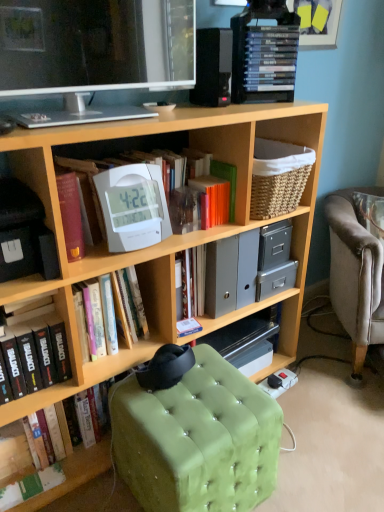
Identify the location of green tufted ottoman at lower center. (195, 433).

What is the approximate height of white plastic clock at center, the fourth book in the bottom-to-top sequence?

white plastic clock at center, the fourth book in the bottom-to-top sequence, is 9.89 inches tall.

Measure the distance between light gray fabric armchair at right and camera.

The distance of light gray fabric armchair at right from camera is 5.10 feet.

This screenshot has height=512, width=384. Describe the element at coordinates (170, 236) in the screenshot. I see `wooden bookcase at center` at that location.

Describe the element at coordinates (31, 486) in the screenshot. This screenshot has width=384, height=512. I see `green paper book at lower left, which appears as the 1th book when ordered from the bottom` at that location.

The image size is (384, 512). I want to click on white plastic clock at upper center, the third book in the top-to-bottom sequence, so click(128, 305).

The image size is (384, 512). Describe the element at coordinates (270, 58) in the screenshot. I see `black matte book at upper right, which is the 1th book from top to bottom` at that location.

Locate an element on the screen. This screenshot has height=512, width=384. green tufted ottoman at lower center is located at coordinates (195, 433).

In the scene shown: Is black cardboard box at left positioned with its back to black matte book at lower left, which is the fourth book in top-to-bottom order?

No.

Based on the photo, from their relative heights in the image, would you say black cardboard box at left is taller or shorter than black matte book at lower left, which is the fourth book in top-to-bottom order?

Considering their sizes, black cardboard box at left has less height than black matte book at lower left, which is the fourth book in top-to-bottom order.

Is black cardboard box at left in contact with black matte book at lower left, which is the fourth book in top-to-bottom order?

black cardboard box at left is not next to black matte book at lower left, which is the fourth book in top-to-bottom order, and they're not touching.

Does point (19, 155) come farther from viewer compared to point (12, 341)?

No, it is in front of (12, 341).

Would you say light gray fabric armchair at right contains orange matte paper at center?

Definitely not — orange matte paper at center is not inside light gray fabric armchair at right.

From the image's perspective, is light gray fabric armchair at right located above or below orange matte paper at center?

light gray fabric armchair at right is below orange matte paper at center.

Considering the relative sizes of light gray fabric armchair at right and orange matte paper at center in the image provided, is light gray fabric armchair at right smaller than orange matte paper at center?

No, light gray fabric armchair at right is not smaller than orange matte paper at center.

From the image's perspective, who appears lower, black plastic speaker at upper center or black cardboard box at left?

A: black cardboard box at left appears lower in the image.

Between black plastic speaker at upper center and black cardboard box at left, which one has smaller size?

Smaller between the two is black plastic speaker at upper center.

Which object is positioned more to the right, black plastic speaker at upper center or black cardboard box at left?

Positioned to the right is black plastic speaker at upper center.

What's the angular difference between wooden bookcase at center and black plastic speaker at upper center's facing directions?

6.48 degrees.

From the image's perspective, between wooden bookcase at center and black plastic speaker at upper center, who is located below?

wooden bookcase at center, from the image's perspective.

Which is in front, wooden bookcase at center or black plastic speaker at upper center?

wooden bookcase at center is closer to the camera.

Is wooden bookcase at center next to black plastic speaker at upper center and touching it?

There is a gap between wooden bookcase at center and black plastic speaker at upper center.

Is wooden bookcase at center inside white plastic clock at upper center, the 3th book positioned from the bottom?

Actually, wooden bookcase at center is outside white plastic clock at upper center, the 3th book positioned from the bottom.

Is wooden bookcase at center at the back of white plastic clock at upper center, the 3th book positioned from the bottom?

Yes, white plastic clock at upper center, the 3th book positioned from the bottom, is positioned with its back facing wooden bookcase at center.

Is white plastic clock at upper center, the third book in the top-to-bottom sequence, directly adjacent to wooden bookcase at center?

No, white plastic clock at upper center, the third book in the top-to-bottom sequence, is not beside wooden bookcase at center.

Does matte white television at upper left have a smaller size compared to gray plastic file folders at center?

Actually, matte white television at upper left might be larger than gray plastic file folders at center.

Which is closer, (x=35, y=87) or (x=213, y=230)?

Point (x=35, y=87)

Is matte white television at upper left positioned before gray plastic file folders at center?

Yes, matte white television at upper left is closer to the viewer.

Does matte white television at upper left appear on the right side of gray plastic file folders at center?

In fact, matte white television at upper left is to the left of gray plastic file folders at center.

Find the location of a particular element. television above the white plastic clock at upper center, the third book in the top-to-bottom sequence (from the image's perspective) is located at coordinates (95, 47).

Is white plastic clock at upper center, the 3th book positioned from the bottom, wider or thinner than matte white television at upper left?

Clearly, white plastic clock at upper center, the 3th book positioned from the bottom, has more width compared to matte white television at upper left.

In the scene shown: Is white plastic clock at upper center, the third book in the top-to-bottom sequence, located outside matte white television at upper left?

Indeed, white plastic clock at upper center, the third book in the top-to-bottom sequence, is completely outside matte white television at upper left.

Is white plastic clock at upper center, the third book in the top-to-bottom sequence, bigger than matte white television at upper left?

No, white plastic clock at upper center, the third book in the top-to-bottom sequence, is not bigger than matte white television at upper left.

Identify the location of the 2nd book to the left when counting from the black cardboard box at left. The width and height of the screenshot is (384, 512). (37, 354).

In order to click on paperback book that appears in front of the light gray fabric armchair at right in this screenshot , I will do `click(227, 180)`.

When comparing their distances from white plastic clock at center, the fourth book in the bottom-to-top sequence, does white plastic clock at upper center or light gray fabric armchair at right seem further?

light gray fabric armchair at right.

Based on their spatial positions, is black matte book at lower left, marked as the second book in a bottom-to-top arrangement, or gray plastic file folders at center further from black matte book at upper right, the 5th book when ordered from bottom to top?

The object further to black matte book at upper right, the 5th book when ordered from bottom to top, is black matte book at lower left, marked as the second book in a bottom-to-top arrangement.

From the image, which object appears to be farther from white plastic clock at center, arranged as the second book when viewed from the top, matte white television at upper left or green paper book at lower left, acting as the 5th book starting from the top?

green paper book at lower left, acting as the 5th book starting from the top.

Estimate the real-world distances between objects in this image. Which object is closer to black matte book at upper right, the 5th book when ordered from bottom to top, black cardboard box at left or gray plastic file folders at center?

The object closer to black matte book at upper right, the 5th book when ordered from bottom to top, is gray plastic file folders at center.

Considering their positions, is matte white television at upper left positioned closer to white plastic clock at upper center, the 3th book positioned from the bottom, than wooden bookcase at center?

Among the two, wooden bookcase at center is located nearer to white plastic clock at upper center, the 3th book positioned from the bottom.

Estimate the real-world distances between objects in this image. Which object is closer to black matte book at upper right, which is the 1th book from top to bottom, black matte book at lower left, which is the fourth book in top-to-bottom order, or white plastic clock at upper center?

Among the two, white plastic clock at upper center is located nearer to black matte book at upper right, which is the 1th book from top to bottom.

From the image, which object appears to be nearer to wooden bookcase at center, black matte book at upper right, which is the 1th book from top to bottom, or light gray fabric armchair at right?

The object closer to wooden bookcase at center is black matte book at upper right, which is the 1th book from top to bottom.

From the image, which object appears to be nearer to orange matte paper at center, matte white television at upper left or wooden bookcase at center?

wooden bookcase at center is positioned closer to the anchor orange matte paper at center.

Where is `bookcase between matte white television at upper left and white plastic clock at upper center, the 3th book positioned from the bottom, in the up-down direction`? bookcase between matte white television at upper left and white plastic clock at upper center, the 3th book positioned from the bottom, in the up-down direction is located at coordinates (170, 236).

The height and width of the screenshot is (512, 384). In order to click on clock between matte white television at upper left and orange matte paper at center along the z-axis in this screenshot , I will do `click(133, 206)`.

Where is `speaker between black matte book at upper right, the 5th book when ordered from bottom to top, and wooden bookcase at center, in the vertical direction`? This screenshot has width=384, height=512. speaker between black matte book at upper right, the 5th book when ordered from bottom to top, and wooden bookcase at center, in the vertical direction is located at coordinates (213, 67).

Where is `music stool between black plastic speaker at upper center and green paper book at lower left, which appears as the 1th book when ordered from the bottom, vertically`? music stool between black plastic speaker at upper center and green paper book at lower left, which appears as the 1th book when ordered from the bottom, vertically is located at coordinates (195, 433).